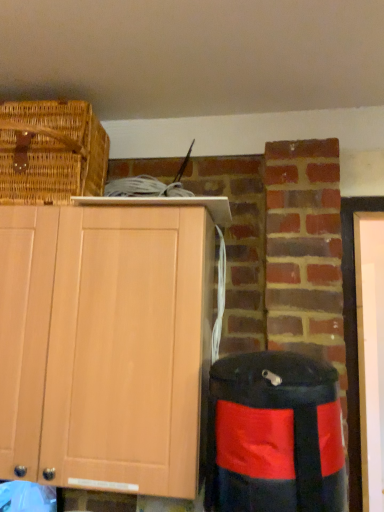
Question: Is light wood cabinet at upper left inside or outside of woven brown picnic basket at upper left?

Choices:
 (A) outside
 (B) inside

Answer: (A)

Question: From their relative heights in the image, would you say light wood cabinet at upper left is taller or shorter than woven brown picnic basket at upper left?

Choices:
 (A) tall
 (B) short

Answer: (A)

Question: Which of these objects is positioned closest to the woven brown picnic basket at upper left?

Choices:
 (A) black fabric trash bin/can at lower right
 (B) light wood cabinet at upper left

Answer: (B)

Question: Based on their relative distances, which object is nearer to the woven brown picnic basket at upper left?

Choices:
 (A) black fabric trash bin/can at lower right
 (B) light wood cabinet at upper left

Answer: (B)